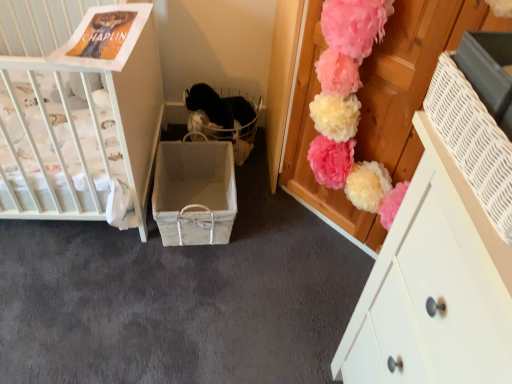
Locate an element on the screen. The image size is (512, 384). free space to the right of white wicker basket at center, the first storage box in the left-to-right sequence is located at coordinates (271, 227).